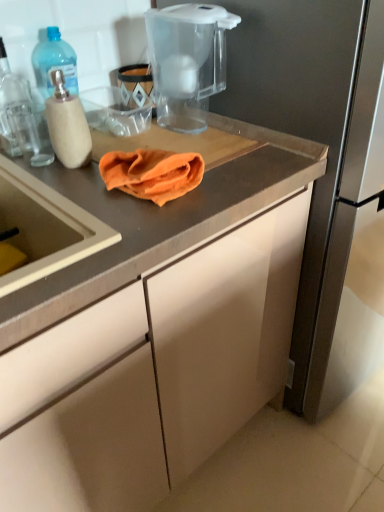
At what (x,y) coordinates should I click in order to perform the action: click on vacant space situated on the left part of transparent plastic water filter pitcher at upper center. Please return your answer as a coordinate pair (x, y). The image size is (384, 512). Looking at the image, I should click on (133, 135).